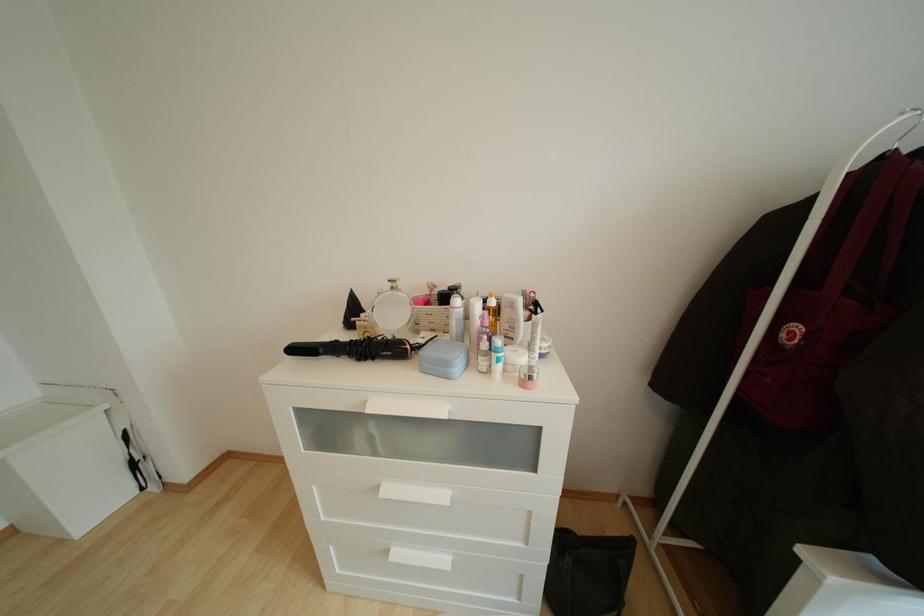
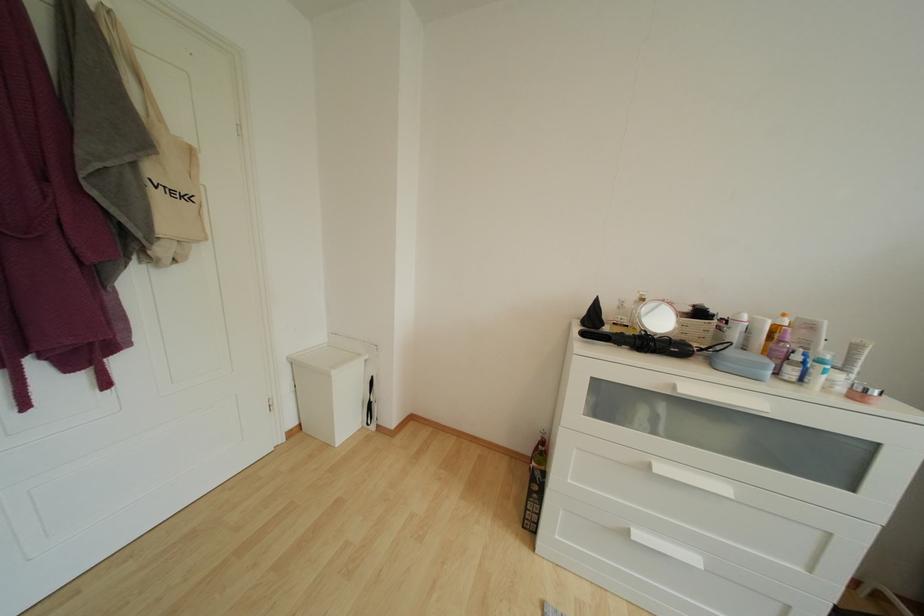
The point at (405, 288) is marked in the first image. Where is the corresponding point in the second image?

(651, 301)